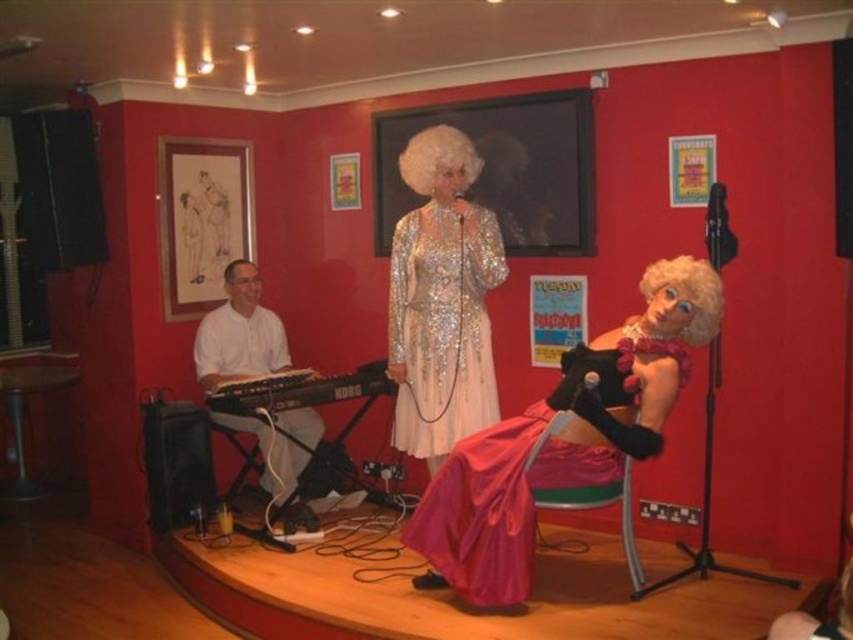
Who is lower down, shiny silver dress at center or white matte keyboard at left?

white matte keyboard at left is below.

Which is more to the left, shiny silver dress at center or white matte keyboard at left?

white matte keyboard at left is more to the left.

Is point (439, 160) positioned in front of point (265, 355)?

Yes, point (439, 160) is closer to viewer.

Identify the location of shiny silver dress at center. This screenshot has width=853, height=640. (440, 300).

Which of these two, shiny pink dress at center or white curly wig at upper center, stands shorter?

With less height is white curly wig at upper center.

Who is taller, shiny pink dress at center or white curly wig at upper center?

With more height is shiny pink dress at center.

I want to click on shiny pink dress at center, so click(556, 445).

The width and height of the screenshot is (853, 640). What are the coordinates of `shiny pink dress at center` in the screenshot? It's located at (556, 445).

Can you confirm if white matte keyboard at left is positioned to the left of white curly wig at center?

Correct, you'll find white matte keyboard at left to the left of white curly wig at center.

Can you confirm if white matte keyboard at left is wider than white curly wig at center?

Correct, the width of white matte keyboard at left exceeds that of white curly wig at center.

Between point (257, 321) and point (454, 161), which one is positioned in front?

Point (454, 161) is more forward.

You are a GUI agent. You are given a task and a screenshot of the screen. Output one action in this format:
    pyautogui.click(x=<x>, y=<y>)
    Task: Click on the white matte keyboard at left
    The width and height of the screenshot is (853, 640).
    Given the screenshot: What is the action you would take?
    pyautogui.click(x=239, y=336)